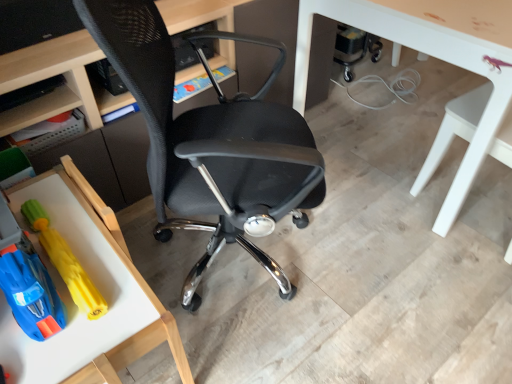
Identify the location of vacant space underneath black mesh chair at center, which appears as the 1th chair when viewed from the left (from a real-world perspective). (238, 265).